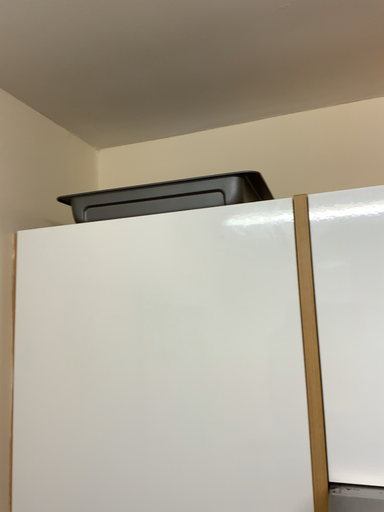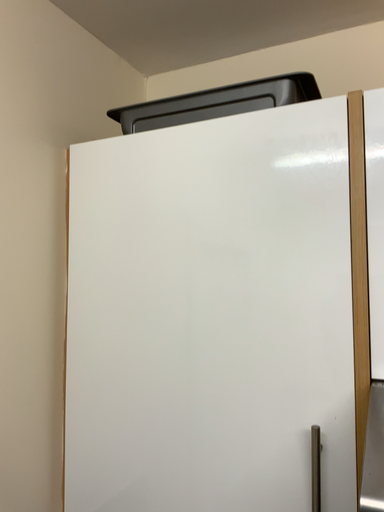
Question: How did the camera likely rotate when shooting the video?

Choices:
 (A) rotated right
 (B) rotated left

Answer: (B)